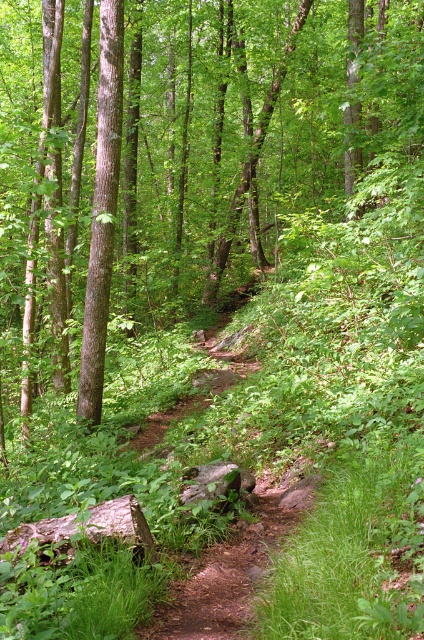
Question: Which of the following is the closest to the observer?

Choices:
 (A) green leafy tree at center
 (B) brown smooth tree at left

Answer: (A)

Question: Does green leafy tree at center have a larger size compared to brown smooth tree at left?

Choices:
 (A) yes
 (B) no

Answer: (A)

Question: Which point is closer to the camera?

Choices:
 (A) (102, 20)
 (B) (351, 176)

Answer: (A)

Question: Is green leafy tree at center closer to camera compared to brown smooth tree at left?

Choices:
 (A) yes
 (B) no

Answer: (A)

Question: Can you confirm if green leafy tree at center is positioned to the left of brown smooth tree at left?

Choices:
 (A) no
 (B) yes

Answer: (A)